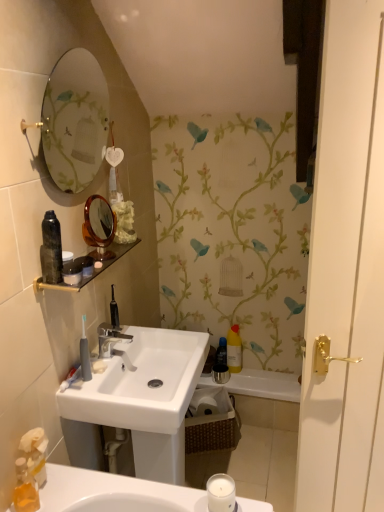
Question: Does yellow matte bottle at center, marked as the 1th toiletry in a right-to-left arrangement, have a greater width compared to matte glass shelf at upper center?

Choices:
 (A) no
 (B) yes

Answer: (A)

Question: Is yellow matte bottle at center, the first toiletry positioned from the back, looking in the opposite direction of matte glass shelf at upper center?

Choices:
 (A) yes
 (B) no

Answer: (B)

Question: Is yellow matte bottle at center, the first toiletry positioned from the back, at the right side of matte glass shelf at upper center?

Choices:
 (A) yes
 (B) no

Answer: (A)

Question: Could you tell me if yellow matte bottle at center, the first toiletry positioned from the back, is turned towards matte glass shelf at upper center?

Choices:
 (A) no
 (B) yes

Answer: (A)

Question: Considering the relative positions of yellow matte bottle at center, marked as the 1th toiletry in a right-to-left arrangement, and matte glass shelf at upper center in the image provided, is yellow matte bottle at center, marked as the 1th toiletry in a right-to-left arrangement, to the left of matte glass shelf at upper center from the viewer's perspective?

Choices:
 (A) yes
 (B) no

Answer: (B)

Question: Is yellow matte bottle at center, acting as the 1th toiletry starting from the bottom, shorter than matte glass shelf at upper center?

Choices:
 (A) no
 (B) yes

Answer: (A)

Question: Is yellow matte bottle at center, the first toiletry positioned from the back, positioned behind white glossy sink at center?

Choices:
 (A) no
 (B) yes

Answer: (B)

Question: From a real-world perspective, is yellow matte bottle at center, which ranks as the 2th toiletry in top-to-bottom order, located higher than white glossy sink at center?

Choices:
 (A) yes
 (B) no

Answer: (B)

Question: Can you confirm if yellow matte bottle at center, which ranks as the 2th toiletry in top-to-bottom order, is thinner than white glossy sink at center?

Choices:
 (A) no
 (B) yes

Answer: (B)

Question: Is yellow matte bottle at center, which is the second toiletry from front to back, in front of white glossy sink at center?

Choices:
 (A) no
 (B) yes

Answer: (A)

Question: Could you tell me if yellow matte bottle at center, which appears as the 2th toiletry when viewed from the left, is facing white glossy sink at center?

Choices:
 (A) yes
 (B) no

Answer: (A)

Question: Can you confirm if yellow matte bottle at center, which appears as the 2th toiletry when viewed from the left, is smaller than white glossy sink at center?

Choices:
 (A) no
 (B) yes

Answer: (B)

Question: Can you confirm if gray rubber toothbrush at lower left, the 2th toiletry in the right-to-left sequence, is shorter than silver metallic faucet at center?

Choices:
 (A) no
 (B) yes

Answer: (A)